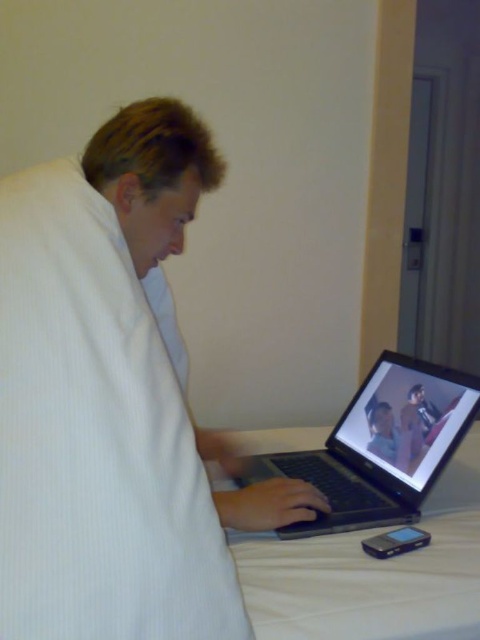
You are a hotel guest who just arrived and wants to check if the white textured robe at center provided by the hotel is taller than the white fabric bed at lower center. Can you confirm this?

The white textured robe at center is much taller than the white fabric bed at lower center, so yes, the robe is taller than the bed.

You are standing at the entrance of the room and want to approach the white fabric bed at lower center. According to the coordinates provided, in which direction should you move relative to the bed?

The white fabric bed at lower center is located at point [373,572]. Since coordinates typically place the origin at the bottom left corner, moving towards the bed would require moving to the right and upwards from the entrance.

You are a hotel guest who just arrived and needs to charge your black plastic laptop at center. You see the white textured robe at center on the bed. Is the laptop accessible for charging without moving the robe?

The white textured robe at center is positioned over the black plastic laptop at center, so you would need to move the robe to access the laptop for charging.